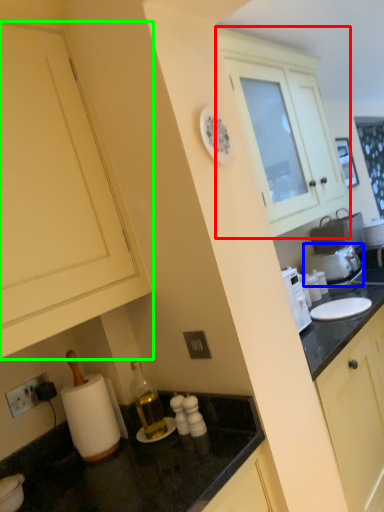
Question: Based on their relative distances, which object is farther from cabinetry (highlighted by a red box)? Choose from appliance (highlighted by a blue box) and cabinetry (highlighted by a green box).

Choices:
 (A) appliance
 (B) cabinetry

Answer: (B)